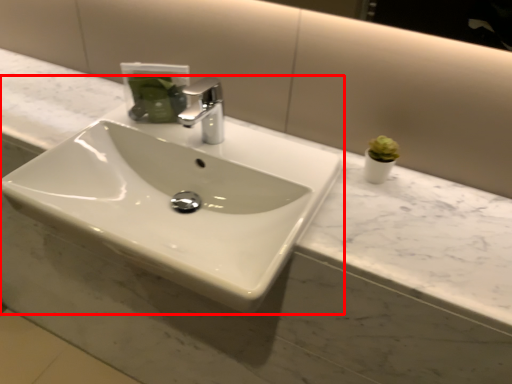
Question: From the image, what is the correct spatial relationship of sink (annotated by the red box) in relation to tap?

Choices:
 (A) left
 (B) right

Answer: (A)